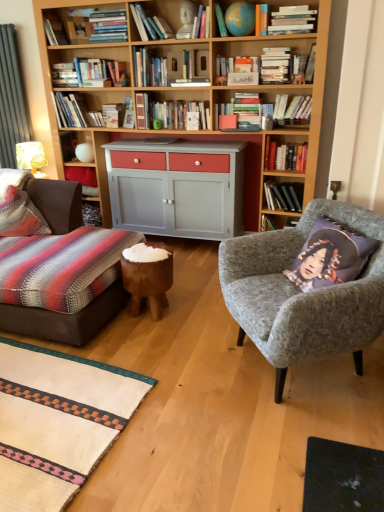
Question: Can you confirm if striped fabric pillow at left is positioned to the right of hardcover book at upper center, placed as the 9th book when sorted from right to left?

Choices:
 (A) no
 (B) yes

Answer: (A)

Question: Does striped fabric pillow at left have a lesser height compared to hardcover book at upper center, placed as the 9th book when sorted from right to left?

Choices:
 (A) yes
 (B) no

Answer: (A)

Question: Can you confirm if striped fabric pillow at left is smaller than hardcover book at upper center, the 7th book from the left?

Choices:
 (A) yes
 (B) no

Answer: (B)

Question: Does striped fabric pillow at left have a lesser width compared to hardcover book at upper center, the 7th book from the left?

Choices:
 (A) yes
 (B) no

Answer: (B)

Question: Is striped fabric pillow at left next to hardcover book at upper center, placed as the 9th book when sorted from right to left?

Choices:
 (A) yes
 (B) no

Answer: (B)

Question: From a real-world perspective, is hardcover books at upper right, the 13th book from the left, positioned above or below hardcover books at upper center, which is the fifth book in right-to-left order?

Choices:
 (A) above
 (B) below

Answer: (B)

Question: Looking at their shapes, would you say hardcover books at upper right, the third book from the right, is wider or thinner than hardcover books at upper center, which is the fifth book in right-to-left order?

Choices:
 (A) thin
 (B) wide

Answer: (A)

Question: Relative to hardcover books at upper center, which ranks as the 11th book in left-to-right order, is hardcover books at upper right, the third book from the right, in front or behind?

Choices:
 (A) behind
 (B) front

Answer: (A)

Question: Is point (289, 150) positioned closer to the camera than point (279, 81)?

Choices:
 (A) closer
 (B) farther

Answer: (B)

Question: Is hardcover book at upper center, marked as the 1th book in a right-to-left arrangement, bigger or smaller than hardcover book at upper left, which is the 1th book in left-to-right order?

Choices:
 (A) big
 (B) small

Answer: (A)

Question: In terms of height, does hardcover book at upper center, marked as the 1th book in a right-to-left arrangement, look taller or shorter compared to hardcover book at upper left, which is the 1th book in left-to-right order?

Choices:
 (A) tall
 (B) short

Answer: (B)

Question: Looking at their shapes, would you say hardcover book at upper center, marked as the 1th book in a right-to-left arrangement, is wider or thinner than hardcover book at upper left, which is the 1th book in left-to-right order?

Choices:
 (A) thin
 (B) wide

Answer: (A)

Question: From the image's perspective, is hardcover book at upper center, marked as the 1th book in a right-to-left arrangement, positioned above or below hardcover book at upper left, which is counted as the fifteenth book, starting from the right?

Choices:
 (A) above
 (B) below

Answer: (B)

Question: Considering the positions of hardcover book at upper center, the 7th book from the left, and hardcover books at upper right, the 13th book from the left, in the image, is hardcover book at upper center, the 7th book from the left, wider or thinner than hardcover books at upper right, the 13th book from the left,?

Choices:
 (A) thin
 (B) wide

Answer: (B)

Question: Is hardcover book at upper center, the 7th book from the left, taller or shorter than hardcover books at upper right, the 13th book from the left?

Choices:
 (A) tall
 (B) short

Answer: (A)